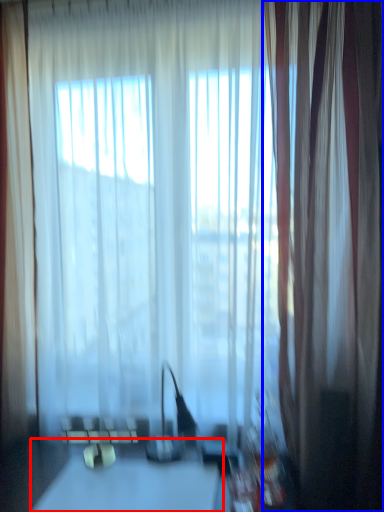
Question: Which object is further to the camera taking this photo, table (highlighted by a red box) or curtain (highlighted by a blue box)?

Choices:
 (A) table
 (B) curtain

Answer: (B)